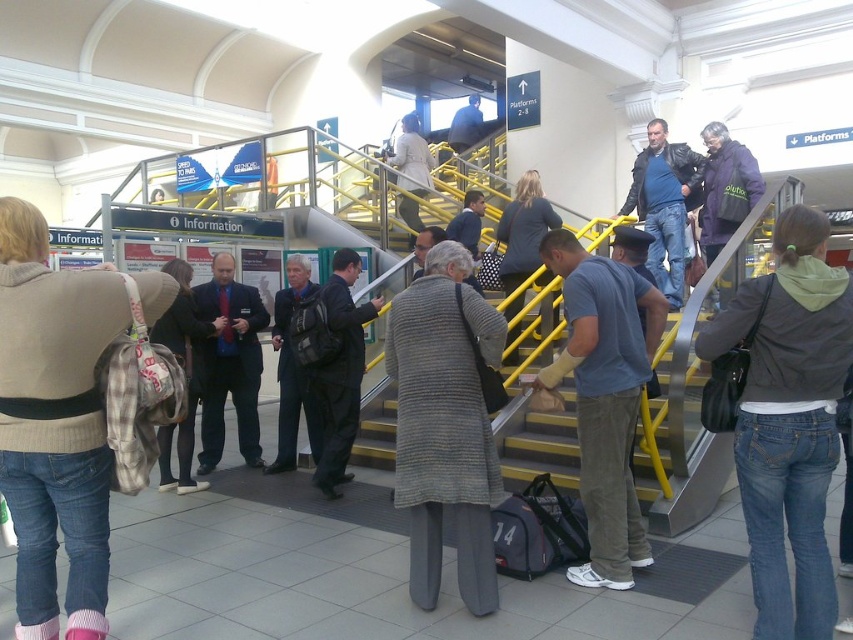
You are standing at the bottom of the staircase in the train station and see both the denim jeans at left and the purple soft jacket at upper right. Which person is closer to you?

The denim jeans at left is closer to the viewer than the purple soft jacket at upper right.

You are standing at point (730, 182) and want to reach point (83, 628). Based on the scene description, which direction should you move to get closer to your destination?

You should move forward because point (83, 628) is in front of point (730, 182).

You are an observer standing at the bottom of the staircase in the train station. You notice two items in the scene described in the image. One is denim jeans at left and the other is purple soft jacket at upper right. Which of these two items is taller?

The denim jeans at left is taller than the purple soft jacket at upper right according to the description provided.